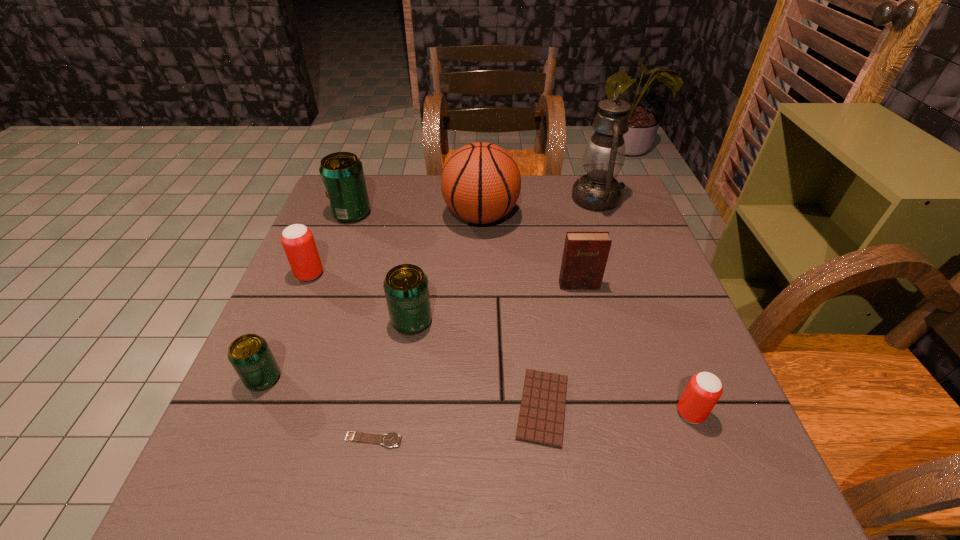
Find the location of `oil lamp`. oil lamp is located at coordinates (604, 156).

This screenshot has height=540, width=960. Identify the location of the second tallest object. (480, 183).

Where is `basketball`? This screenshot has height=540, width=960. basketball is located at coordinates (480, 183).

You are a GUI agent. You are given a task and a screenshot of the screen. Output one action in this format:
    pyautogui.click(x=<x>, y=<y>)
    Task: Click on the farthest green beer can
    This screenshot has width=960, height=540.
    Given the screenshot: What is the action you would take?
    pyautogui.click(x=342, y=175)

Where is `the tallest beer can`? The image size is (960, 540). the tallest beer can is located at coordinates (342, 175).

Locate an element on the screen. reddish-brown diary is located at coordinates [585, 254].

Where is `the third nearest beer can`? The image size is (960, 540). the third nearest beer can is located at coordinates (406, 288).

You are a GUI agent. You are given a task and a screenshot of the screen. Output one action in this format:
    pyautogui.click(x=<x>, y=<y>)
    Task: Click on the fourth beer can from left to right
    The image size is (960, 540).
    Given the screenshot: What is the action you would take?
    pyautogui.click(x=406, y=288)

The width and height of the screenshot is (960, 540). I want to click on the fourth nearest beer can, so click(298, 242).

Locate an element on the screen. The width and height of the screenshot is (960, 540). the bigger red beer can is located at coordinates (298, 242).